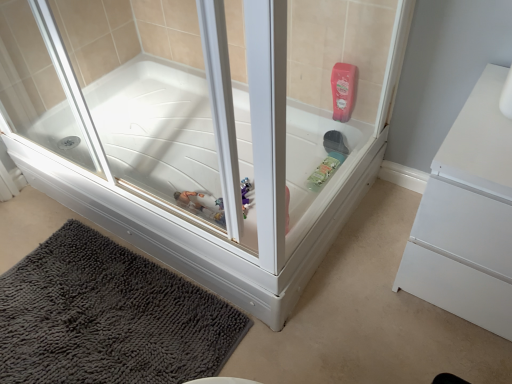
This screenshot has height=384, width=512. I want to click on empty space that is ontop of dark gray shaggy bath mat at lower left (from a real-world perspective), so click(x=100, y=314).